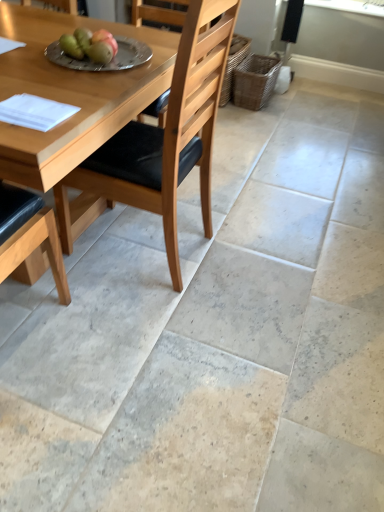
Locate an element on the screen. Image resolution: width=384 pixels, height=512 pixels. vacant space positioned to the left of green matte apple at upper left, acting as the 2th fruit starting from the right is located at coordinates (29, 51).